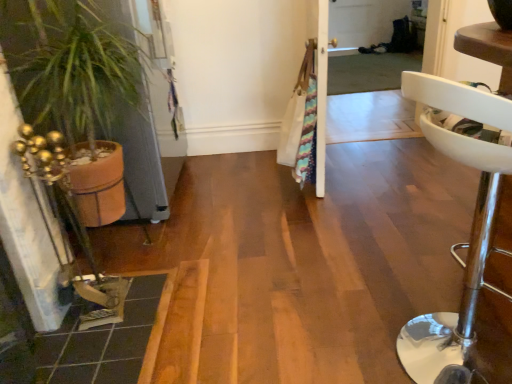
Question: Is transparent plastic screen door at upper center next to terracotta pot at left?

Choices:
 (A) no
 (B) yes

Answer: (A)

Question: From a real-world perspective, is transparent plastic screen door at upper center beneath terracotta pot at left?

Choices:
 (A) no
 (B) yes

Answer: (B)

Question: Is transparent plastic screen door at upper center taller than terracotta pot at left?

Choices:
 (A) no
 (B) yes

Answer: (A)

Question: From the image's perspective, is transparent plastic screen door at upper center below terracotta pot at left?

Choices:
 (A) yes
 (B) no

Answer: (B)

Question: Can you confirm if transparent plastic screen door at upper center is bigger than terracotta pot at left?

Choices:
 (A) yes
 (B) no

Answer: (B)

Question: Is transparent plastic screen door at upper center thinner than terracotta pot at left?

Choices:
 (A) no
 (B) yes

Answer: (B)

Question: Is terracotta pot at left positioned before transparent plastic screen door at upper center?

Choices:
 (A) yes
 (B) no

Answer: (A)

Question: From the image's perspective, is terracotta pot at left below transparent plastic screen door at upper center?

Choices:
 (A) yes
 (B) no

Answer: (A)

Question: Is transparent plastic screen door at upper center at the back of terracotta pot at left?

Choices:
 (A) yes
 (B) no

Answer: (B)

Question: From the image's perspective, would you say terracotta pot at left is positioned over transparent plastic screen door at upper center?

Choices:
 (A) no
 (B) yes

Answer: (A)

Question: Considering the relative positions of terracotta pot at left and transparent plastic screen door at upper center in the image provided, is terracotta pot at left to the right of transparent plastic screen door at upper center from the viewer's perspective?

Choices:
 (A) no
 (B) yes

Answer: (A)

Question: Is terracotta pot at left positioned behind transparent plastic screen door at upper center?

Choices:
 (A) yes
 (B) no

Answer: (B)

Question: Is terracotta pot at left behind white leather stool at right?

Choices:
 (A) no
 (B) yes

Answer: (B)